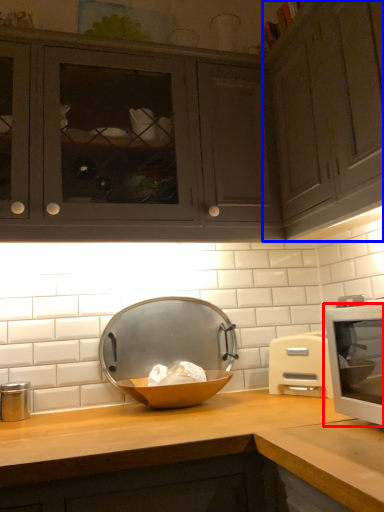
Question: Which of the following is the closest to the observer, home appliance (highlighted by a red box) or cabinetry (highlighted by a blue box)?

Choices:
 (A) home appliance
 (B) cabinetry

Answer: (A)